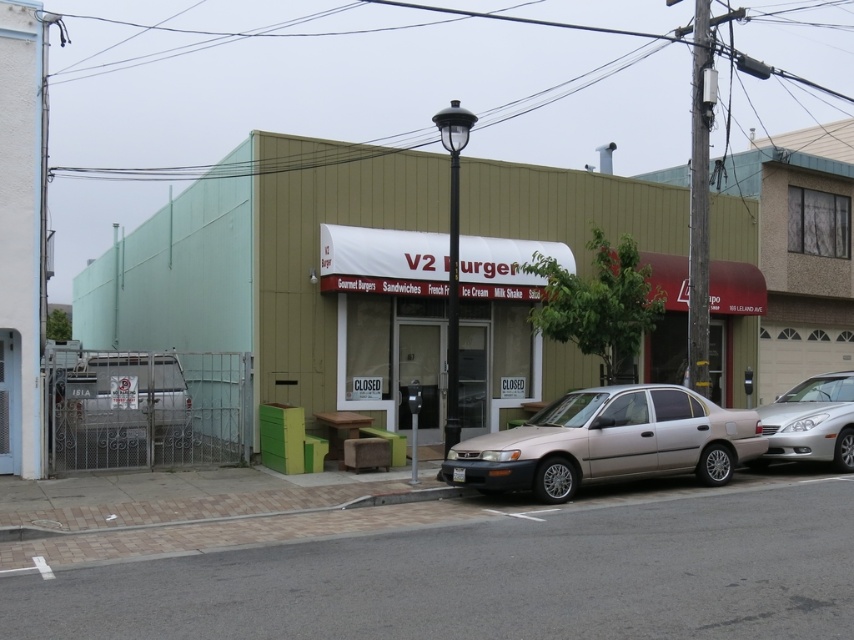
Question: Which of the following is the farthest from the observer?

Choices:
 (A) satin beige sedan at center
 (B) silver metallic sedan at right
 (C) beige textured building at center

Answer: (C)

Question: From the image, what is the correct spatial relationship of beige textured building at center in relation to silver metallic sedan at right?

Choices:
 (A) left
 (B) right

Answer: (A)

Question: Considering the real-world distances, which object is farthest from the satin beige sedan at center?

Choices:
 (A) beige textured building at center
 (B) silver metallic sedan at right
 (C) metallic silver van at lower left

Answer: (A)

Question: Can you confirm if metallic silver van at lower left is positioned below silver metallic sedan at right?

Choices:
 (A) yes
 (B) no

Answer: (B)

Question: Does satin beige sedan at center lie behind metallic silver van at lower left?

Choices:
 (A) no
 (B) yes

Answer: (A)

Question: Which point appears farthest from the camera in this image?

Choices:
 (A) (820, 426)
 (B) (459, 474)

Answer: (A)